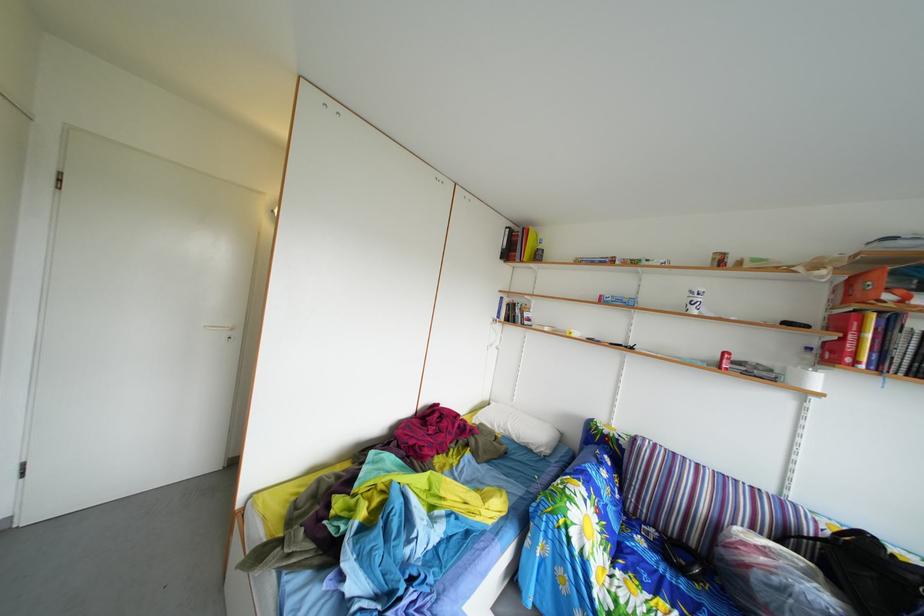
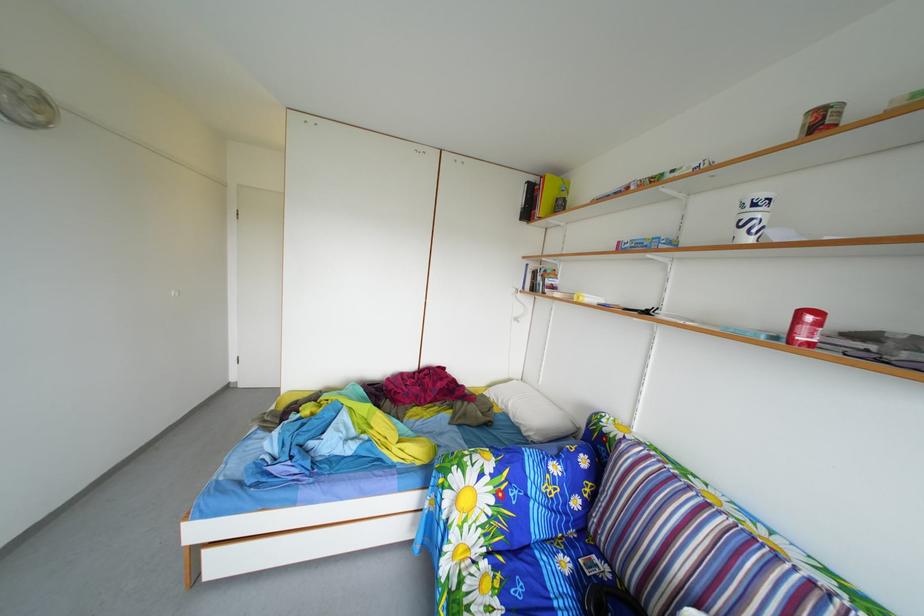
The point at [650,548] is marked in the first image. Where is the corresponding point in the second image?

(576, 570)